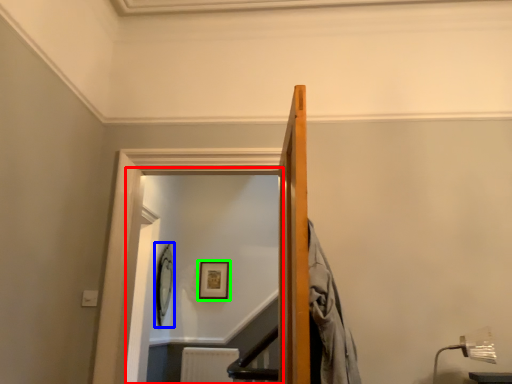
Question: Which is farther away from glass door (highlighted by a red box)? picture frame (highlighted by a blue box) or picture frame (highlighted by a green box)?

Choices:
 (A) picture frame
 (B) picture frame

Answer: (B)